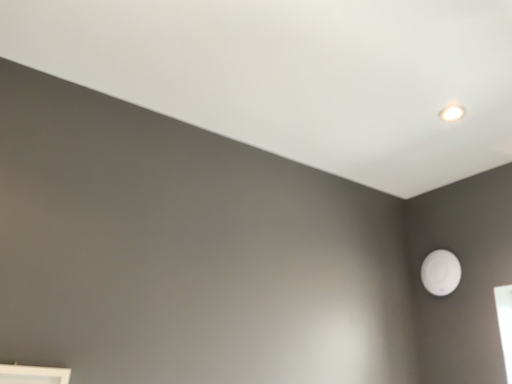
Question: Should I look upward or downward to see white matte light fixture at upper right?

Choices:
 (A) up
 (B) down

Answer: (B)